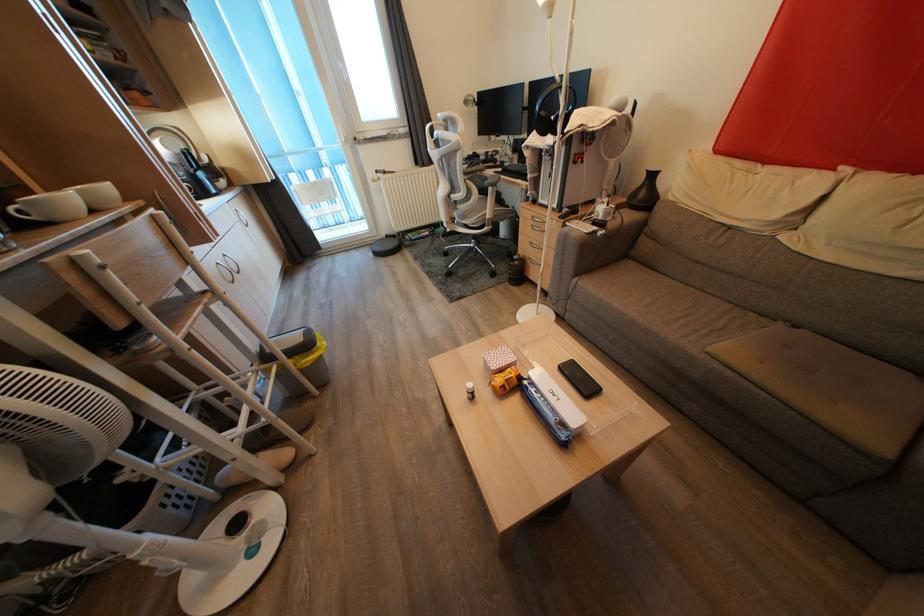
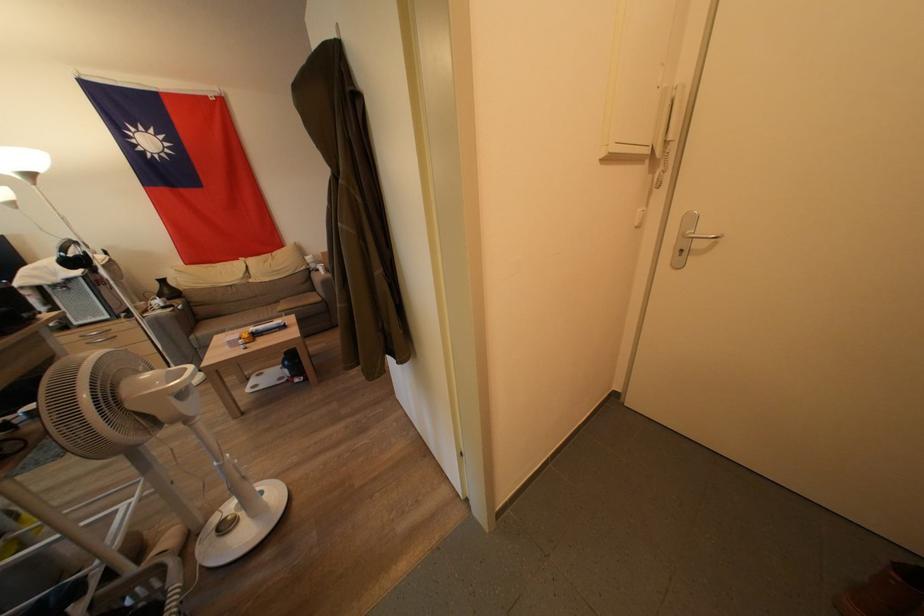
Find the pixel in the second image that matches point (658, 241) in the first image.

(207, 309)